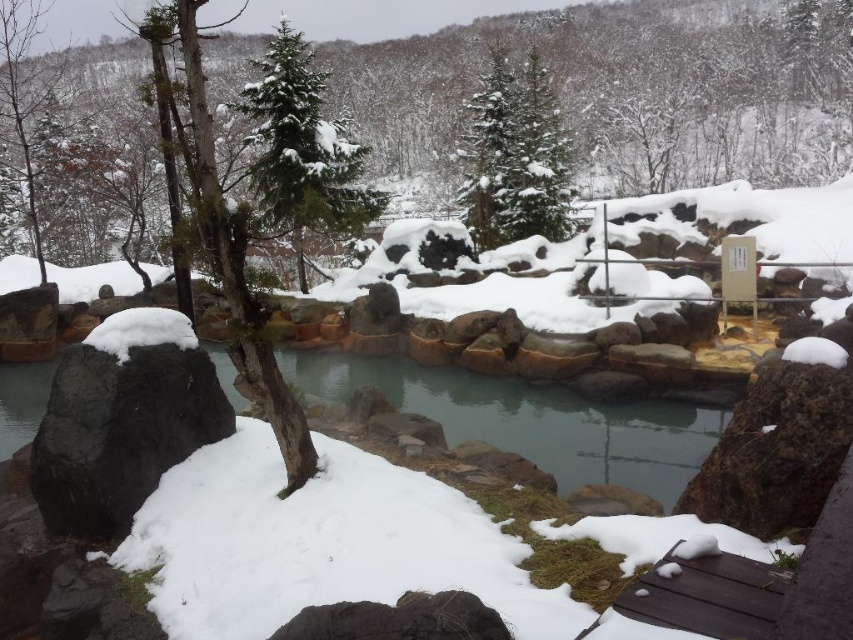
Is clear water at center taller than green textured evergreen tree at upper center?

In fact, clear water at center may be shorter than green textured evergreen tree at upper center.

This screenshot has width=853, height=640. Find the location of `clear water at center`. clear water at center is located at coordinates (531, 419).

Where is `clear water at center`? The image size is (853, 640). clear water at center is located at coordinates (531, 419).

Is clear water at center closer to the viewer compared to green textured pine tree at upper center?

No, it is behind green textured pine tree at upper center.

This screenshot has width=853, height=640. What do you see at coordinates (531, 419) in the screenshot? I see `clear water at center` at bounding box center [531, 419].

Does point (347, 387) lie in front of point (312, 138)?

Yes, point (347, 387) is in front of point (312, 138).

This screenshot has width=853, height=640. In order to click on clear water at center in this screenshot , I will do `click(531, 419)`.

Who is higher up, green textured pine tree at upper center or green textured evergreen tree at upper center?

green textured pine tree at upper center is higher up.

Does green textured pine tree at upper center have a greater height compared to green textured evergreen tree at upper center?

Yes, green textured pine tree at upper center is taller than green textured evergreen tree at upper center.

Where is `green textured pine tree at upper center`? green textured pine tree at upper center is located at coordinates (302, 150).

Find the location of a particular element. The width and height of the screenshot is (853, 640). green textured pine tree at upper center is located at coordinates (302, 150).